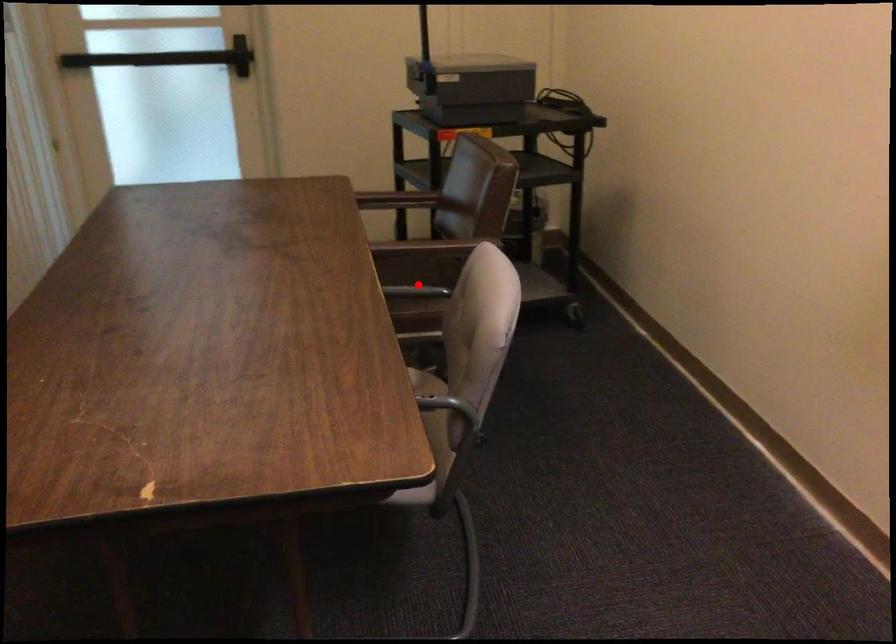
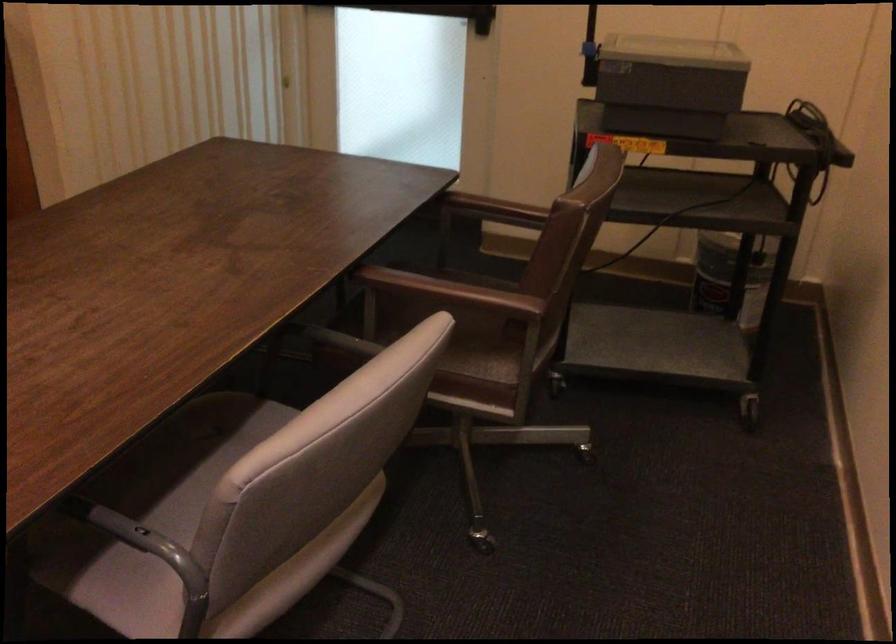
Where in the second image is the point corresponding to the highlighted location from the first image?

(477, 335)